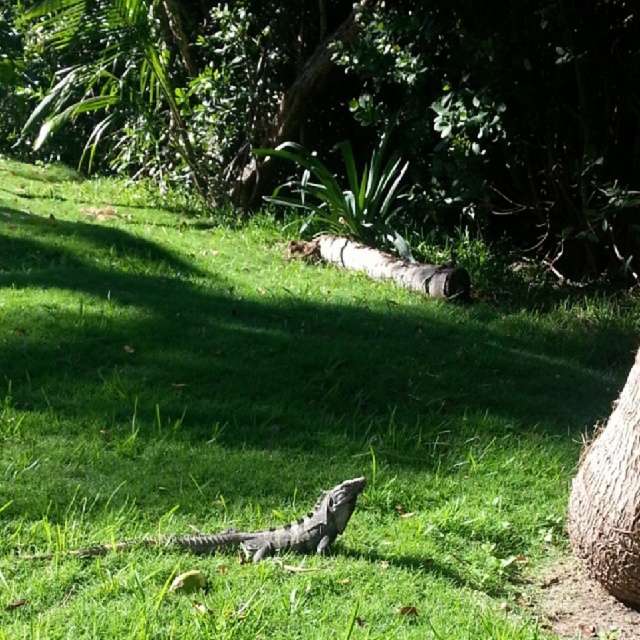
Based on the photo, you are standing in the scene and want to place a small flag at point A and point B. Given that point A is at coordinates point [573,508] and point B is at coordinates point [248,547], which point is closer to you?

Point B at coordinates point [248,547] is closer to you because it is nearer to the camera compared to point A at coordinates point [573,508].

You are a photographer aiming to capture the green scaly lizard at center and the brown rough log at center in a single shot. Based on their positions, can you determine which object is closer to the camera?

The green scaly lizard at center is below the brown rough log at center, so the lizard is closer to the camera than the log.

You are a small insect trying to reach the green scaly lizard at center from the brown rough tree trunk at lower right. Which direction should you move to get closer to the lizard?

The brown rough tree trunk at lower right is closer to you than the green scaly lizard at center, so to reach the lizard, you should move away from the tree trunk towards the direction where the lizard is located, which is further away from your current position.